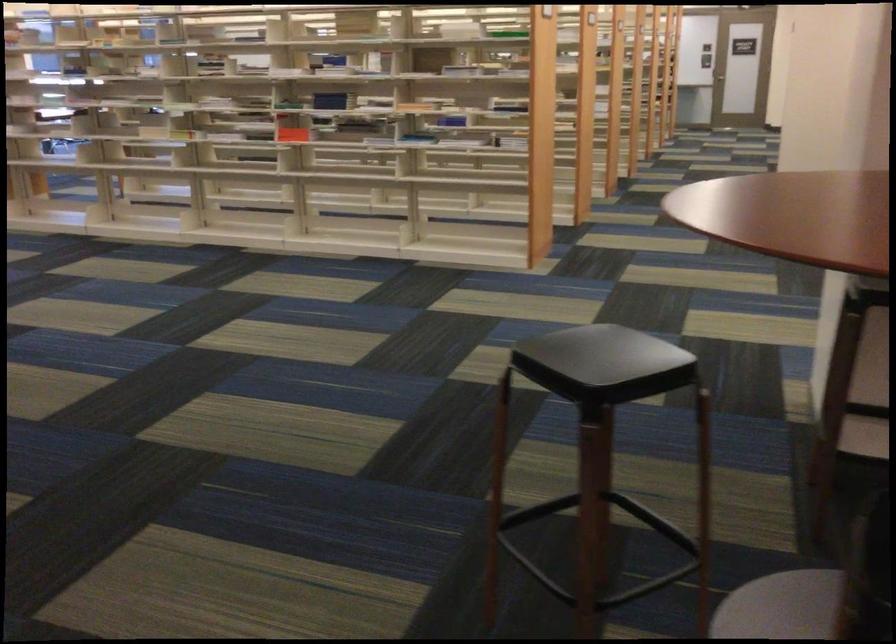
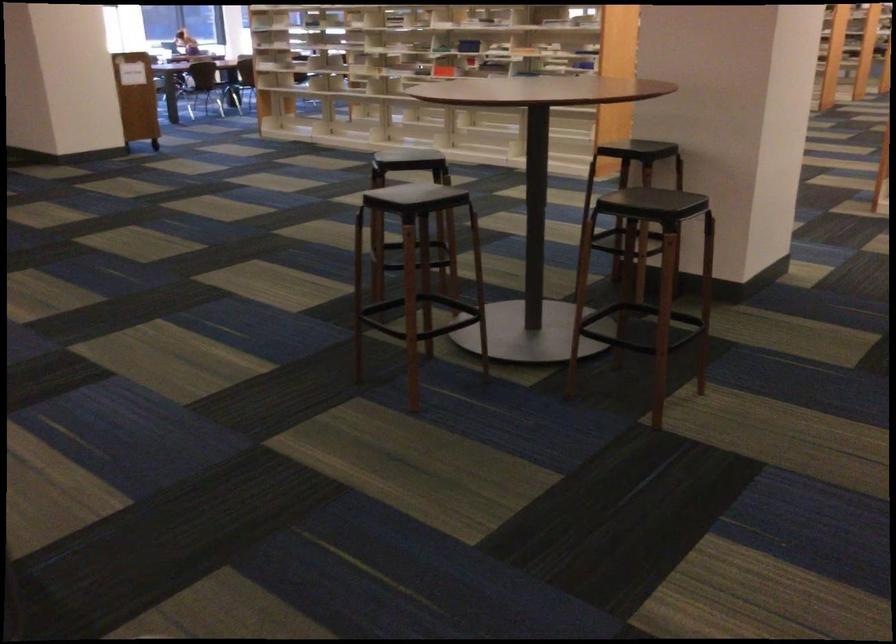
Locate, in the second image, the point that corresponds to point 366,136 in the first image.

(469, 46)